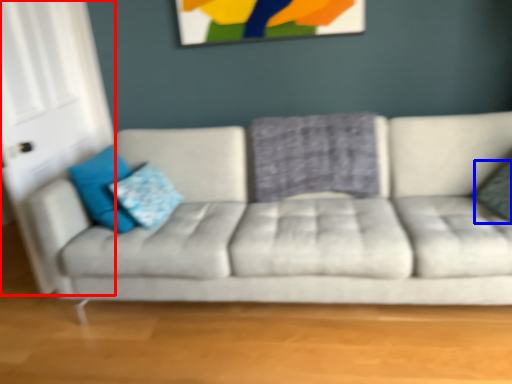
Question: Which of the following is the closest to the observer, glass door (highlighted by a red box) or pillow (highlighted by a blue box)?

Choices:
 (A) glass door
 (B) pillow

Answer: (B)